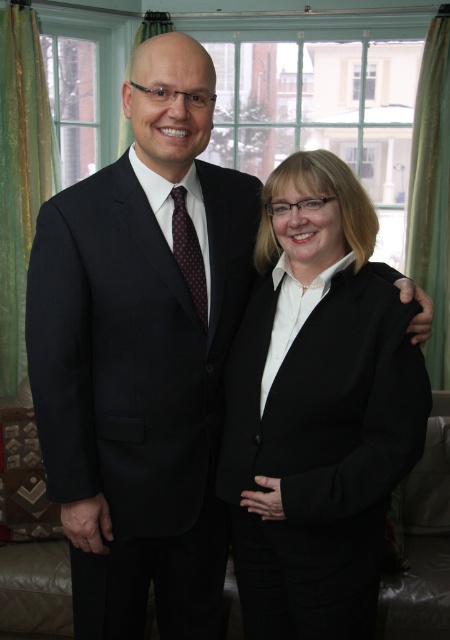
You are a photographer setting up for a photo shoot in this room. You want to ensure that both green sheer curtain at left and green fabric curtain at right are visible in the frame. Which curtain should you position closer to the camera to make sure both are fully visible?

The green sheer curtain at left is larger in size than the green fabric curtain at right. To ensure both are fully visible, position the green sheer curtain at left closer to the camera so its larger size can be accommodated within the frame while still capturing the smaller green fabric curtain at right in the background.

Based on the scene description, which curtain is shorter? The green sheer curtain at left or the green fabric curtain at right?

The green sheer curtain at left is shorter than the green fabric curtain at right.

You are a photographer setting up a shoot in this room. You need to position a light source between the black matte blazer at center and the green fabric curtain at right. Based on their positions, where should you place the light source?

The light source should be placed below the green fabric curtain at right and above the black matte blazer at center since the black matte blazer at center is below the green fabric curtain at right.